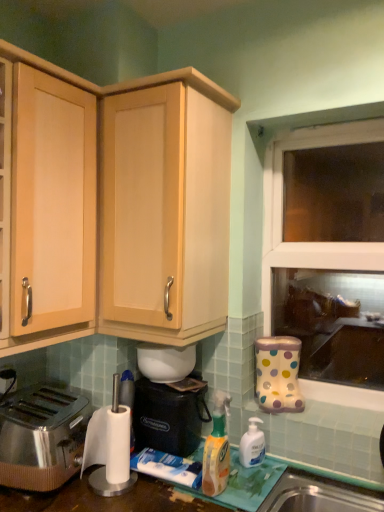
Question: In which direction should I rotate to look at white translucent pump bottle at lower center, the 1th bottle viewed from the back?

Choices:
 (A) right
 (B) left

Answer: (A)

Question: Considering the relative sizes of transparent glass window at right and light wood cabinet at left, acting as the 2th cabinetry starting from the right, in the image provided, is transparent glass window at right thinner than light wood cabinet at left, acting as the 2th cabinetry starting from the right,?

Choices:
 (A) no
 (B) yes

Answer: (B)

Question: Is transparent glass window at right completely or partially outside of light wood cabinet at left, the 1th cabinetry viewed from the left?

Choices:
 (A) no
 (B) yes

Answer: (B)

Question: From a real-world perspective, does transparent glass window at right stand above light wood cabinet at left, the 1th cabinetry viewed from the left?

Choices:
 (A) no
 (B) yes

Answer: (A)

Question: Does transparent glass window at right turn towards light wood cabinet at left, the 1th cabinetry viewed from the left?

Choices:
 (A) no
 (B) yes

Answer: (A)

Question: Does transparent glass window at right have a greater width compared to light wood cabinet at left, acting as the 2th cabinetry starting from the right?

Choices:
 (A) yes
 (B) no

Answer: (B)

Question: Is transparent glass window at right positioned far away from light wood cabinet at left, acting as the 2th cabinetry starting from the right?

Choices:
 (A) yes
 (B) no

Answer: (A)

Question: Does white translucent pump bottle at lower center, marked as the second bottle in a left-to-right arrangement, have a larger size compared to white glossy bowl at center, placed as the first appliance when sorted from top to bottom?

Choices:
 (A) no
 (B) yes

Answer: (A)

Question: Is white translucent pump bottle at lower center, the 2th bottle when ordered from front to back, behind white glossy bowl at center, placed as the first appliance when sorted from top to bottom?

Choices:
 (A) no
 (B) yes

Answer: (A)

Question: Is white translucent pump bottle at lower center, marked as the second bottle in a left-to-right arrangement, facing towards white glossy bowl at center, placed as the first appliance when sorted from top to bottom?

Choices:
 (A) yes
 (B) no

Answer: (B)

Question: From a real-world perspective, is white translucent pump bottle at lower center, which ranks as the first bottle in right-to-left order, located higher than white glossy bowl at center, placed as the first appliance when sorted from top to bottom?

Choices:
 (A) no
 (B) yes

Answer: (A)

Question: From a real-world perspective, is white translucent pump bottle at lower center, the 2th bottle when ordered from front to back, under white glossy bowl at center, the second appliance in the bottom-to-top sequence?

Choices:
 (A) no
 (B) yes

Answer: (B)

Question: Is white translucent pump bottle at lower center, the 1th bottle viewed from the back, with white glossy bowl at center, the second appliance in the bottom-to-top sequence?

Choices:
 (A) no
 (B) yes

Answer: (A)

Question: Can you confirm if white glossy bowl at center, placed as the first appliance when sorted from top to bottom, is thinner than polished stainless steel toaster at lower left?

Choices:
 (A) no
 (B) yes

Answer: (B)